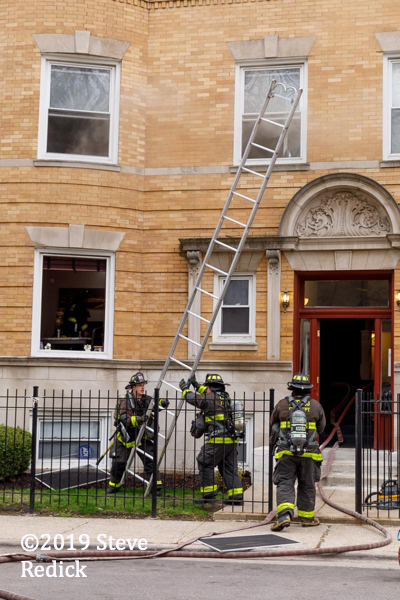
This screenshot has height=600, width=400. What are the coordinates of `opened front door` in the screenshot? It's located at (339, 352).